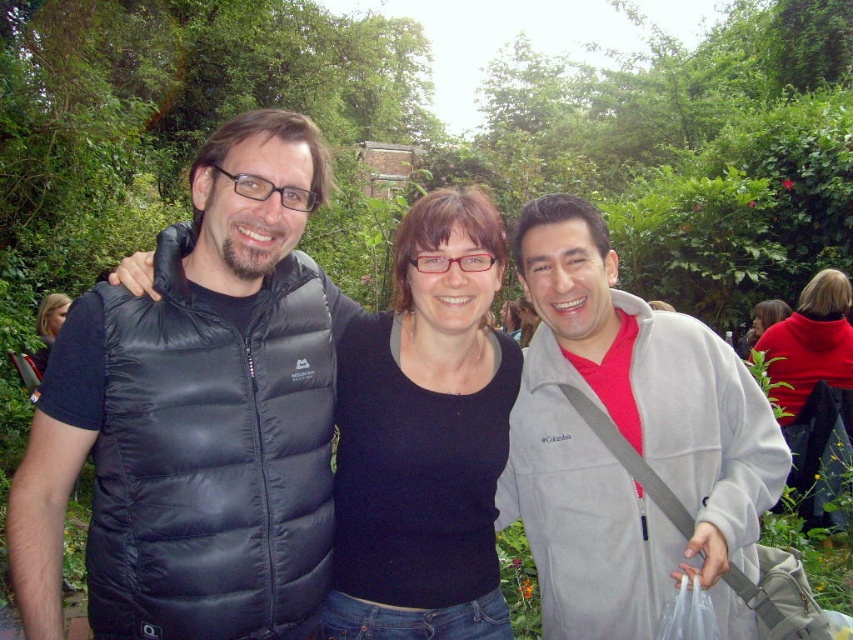
Question: Does gray fleece jacket at center have a smaller size compared to black matte sweater at center?

Choices:
 (A) yes
 (B) no

Answer: (B)

Question: Which object appears farthest from the camera in this image?

Choices:
 (A) black puffy vest at left
 (B) black matte shirt at center
 (C) matte red sweater at right
 (D) black matte sweater at center

Answer: (C)

Question: Which object appears farthest from the camera in this image?

Choices:
 (A) black matte sweater at center
 (B) gray fleece jacket at center
 (C) black matte shirt at center

Answer: (A)

Question: From the image, what is the correct spatial relationship of black puffy vest at left in relation to gray fleece jacket at center?

Choices:
 (A) below
 (B) above

Answer: (B)

Question: Which point is farther from the camera taking this photo?

Choices:
 (A) (219, 300)
 (B) (828, 344)
 (C) (459, 582)
 (D) (666, 522)

Answer: (B)

Question: Observing the image, what is the correct spatial positioning of gray fleece jacket at center in reference to black matte shirt at center?

Choices:
 (A) right
 (B) left

Answer: (A)